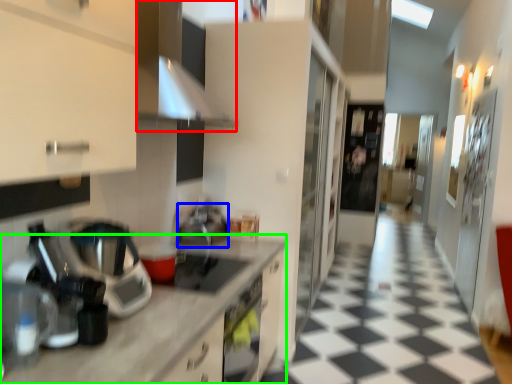
Question: Which object is the farthest from exhaust hood (highlighted by a red box)? Choose among these: appliance (highlighted by a blue box) or countertop (highlighted by a green box).

Choices:
 (A) appliance
 (B) countertop

Answer: (A)